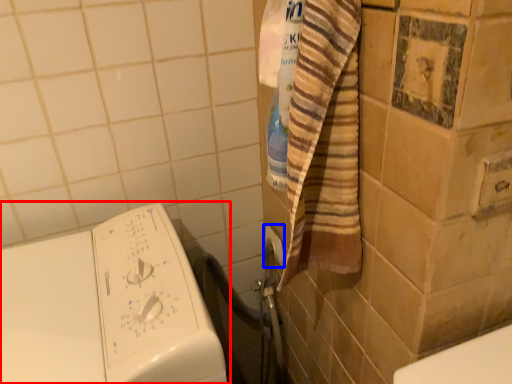
Question: Which point is closer to the camera, washing machine (highlighted by a red box) or electric outlet (highlighted by a blue box)?

Choices:
 (A) washing machine
 (B) electric outlet

Answer: (A)